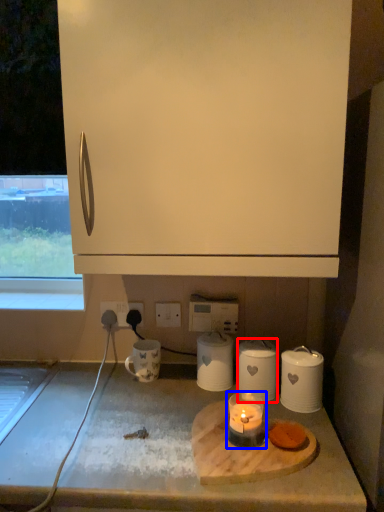
Question: Which of the following is the farthest to the observer, kitchen appliance (highlighted by a red box) or candle holder (highlighted by a blue box)?

Choices:
 (A) kitchen appliance
 (B) candle holder

Answer: (A)